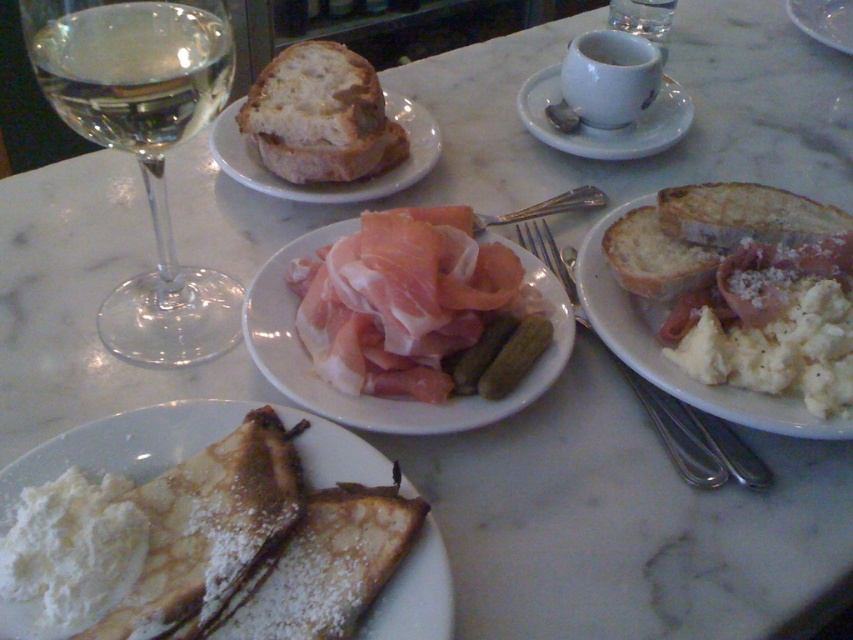
Question: Is golden brown crusty bread at center further to the viewer compared to white ceramic cup at upper center?

Choices:
 (A) no
 (B) yes

Answer: (A)

Question: Estimate the real-world distances between objects in this image. Which object is closer to the clear glass wine at upper left?

Choices:
 (A) white matte plate at upper center
 (B) white creamy mashed potatoes at center

Answer: (B)

Question: Which object is positioned farthest from the white crusty bread at upper right?

Choices:
 (A) golden brown crusty bread at center
 (B) powdered sugar crepe at lower left
 (C) pink/semi-translucent meat at center

Answer: (B)

Question: Estimate the real-world distances between objects in this image. Which object is farther from the white creamy mashed potatoes at center?

Choices:
 (A) clear glass wine at upper left
 (B) powdered sugar crepe at lower left
 (C) white crusty bread at upper right
 (D) white matte plate at upper center

Answer: (D)

Question: Considering the relative positions of golden brown crusty bread at center and white bread at center in the image provided, where is golden brown crusty bread at center located with respect to white bread at center?

Choices:
 (A) above
 (B) below

Answer: (A)

Question: Does transparent glass wine glass at left appear over powdered sugar crepe at lower left?

Choices:
 (A) yes
 (B) no

Answer: (A)